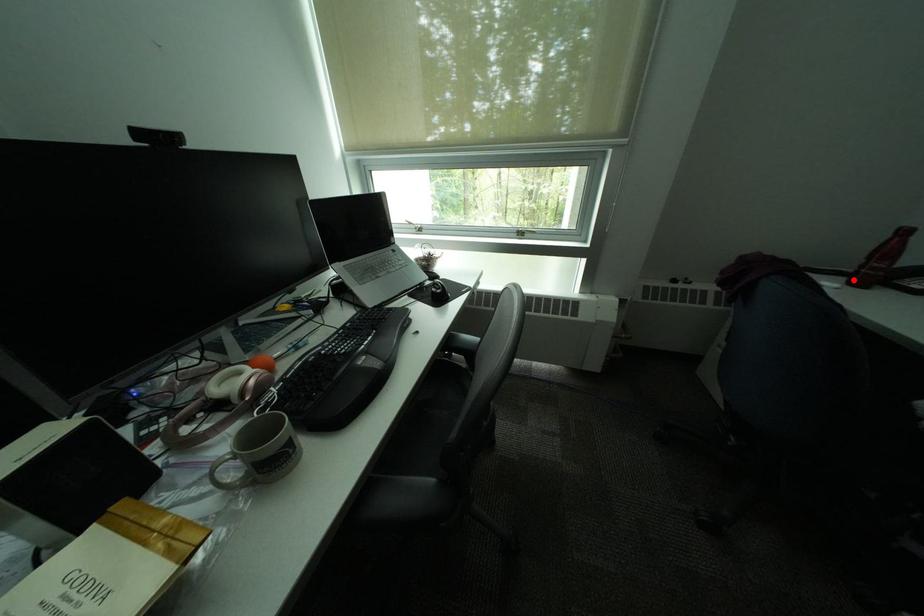
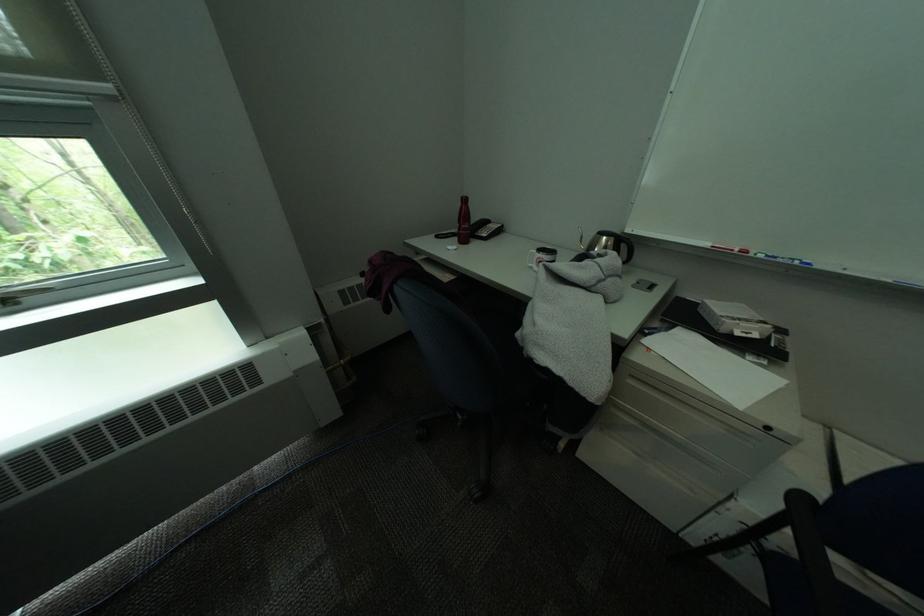
In the second image, find the point that corresponds to the highlighted location in the first image.

(466, 241)